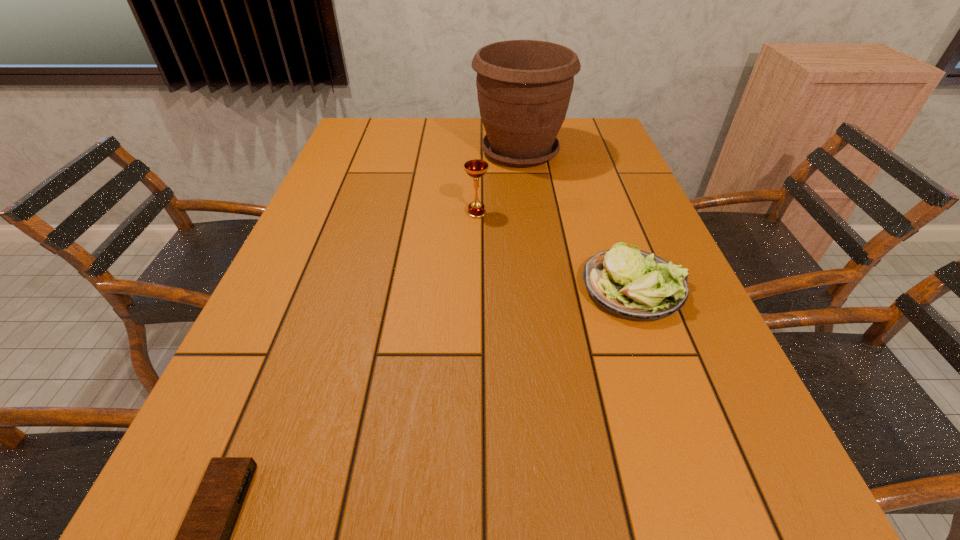
You are a GUI agent. You are given a task and a screenshot of the screen. Output one action in this format:
    pyautogui.click(x=<x>, y=<y>)
    Task: Click on the flowerpot
    Image resolution: width=960 pixels, height=540 pixels.
    Given the screenshot: What is the action you would take?
    pyautogui.click(x=524, y=87)

This screenshot has width=960, height=540. What are the coordinates of `the farthest object` in the screenshot? It's located at (524, 87).

Where is `the third shortest object`? The height and width of the screenshot is (540, 960). the third shortest object is located at coordinates (475, 168).

Where is `the third nearest object`? The height and width of the screenshot is (540, 960). the third nearest object is located at coordinates (475, 168).

Find the location of `the second shortest object`. the second shortest object is located at coordinates (632, 284).

Locate an element on the screen. The width and height of the screenshot is (960, 540). lettuce is located at coordinates (632, 284).

This screenshot has width=960, height=540. I want to click on free space located on the left of the flowerpot, so click(x=438, y=152).

At what (x,y) coordinates should I click in order to perform the action: click on free space located on the front of the second tallest object. Please return your answer as a coordinate pair (x, y). Looking at the image, I should click on (476, 239).

Identify the location of vacant region located on the left of the second shortest object. The width and height of the screenshot is (960, 540). (485, 287).

What are the coordinates of `object present at the far edge` in the screenshot? It's located at (524, 87).